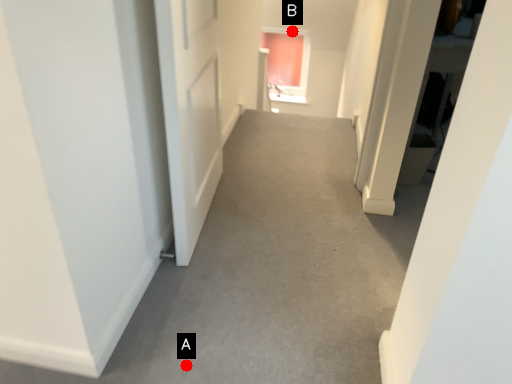
Question: Two points are circled on the image, labeled by A and B beside each circle. Which point is closer to the camera?

Choices:
 (A) A is closer
 (B) B is closer

Answer: (A)